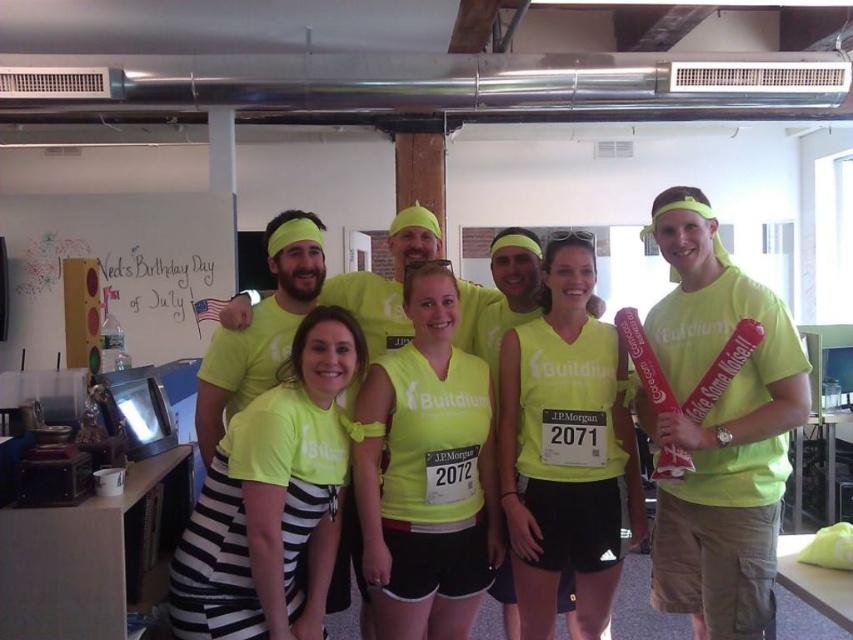
You are standing in the room where the group is posing. If you want to find the neon yellow shirt at center, where should you look?

The neon yellow shirt at center is located at point (273, 499) in the image coordinates.

You are standing in front of the group photo and want to know which of the two points, point (x=316, y=420) or point (x=614, y=486), is closer to you. Can you determine this based on their positions?

Point (x=316, y=420) is closer to the camera than point (x=614, y=486), so it is closer to you.